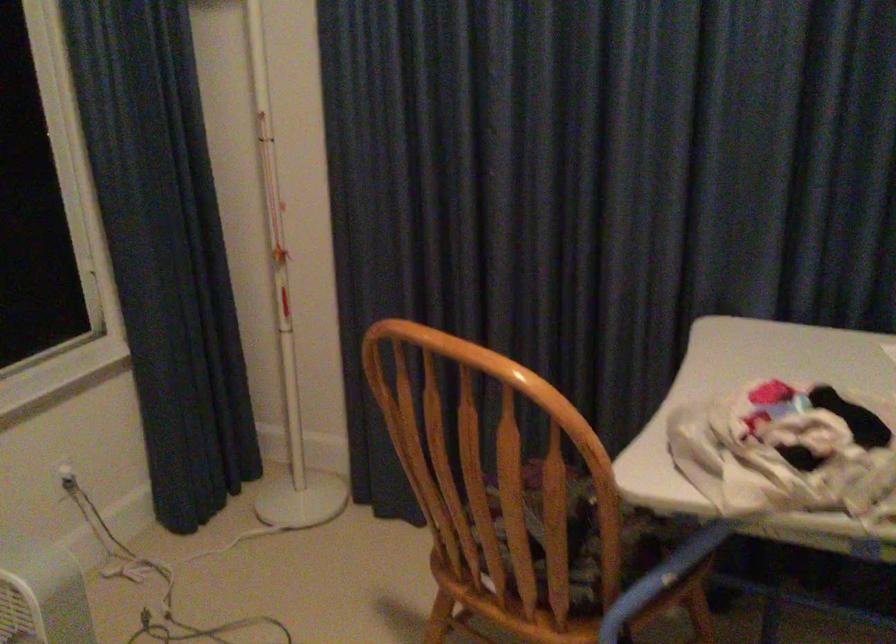
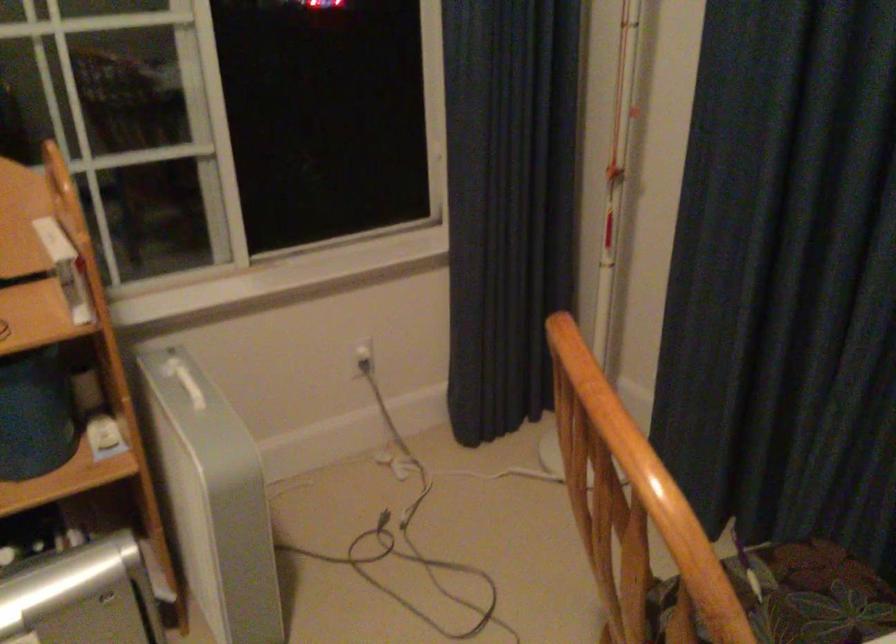
Find the pixel in the second image that matches (x=72, y=469) in the first image.

(363, 355)